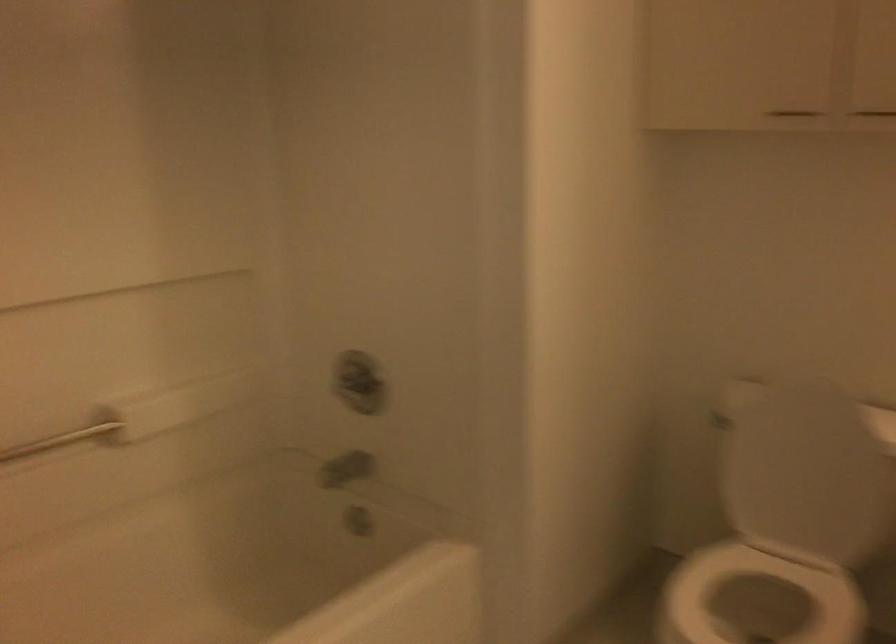
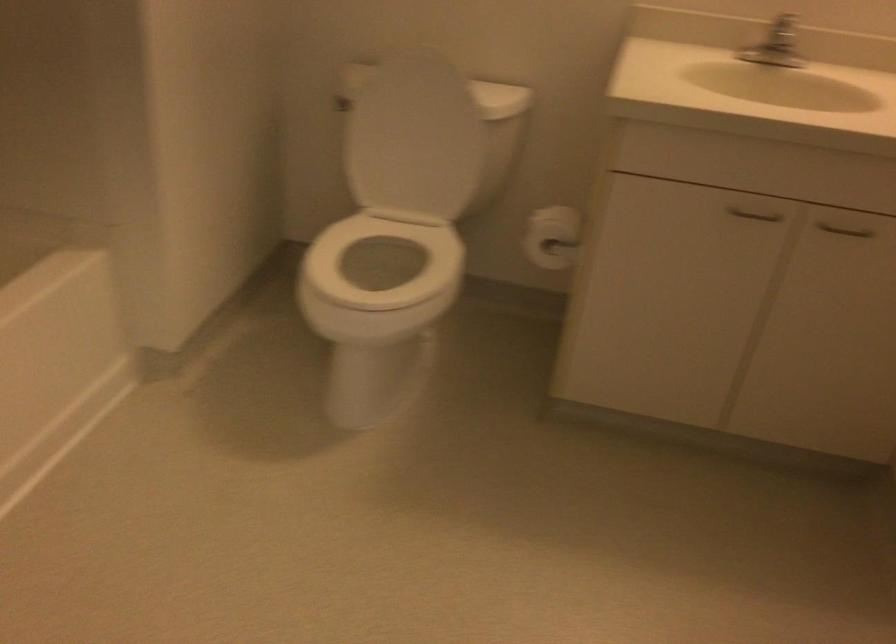
Where in the second image is the point corresponding to (x=720, y=418) from the first image?

(340, 104)